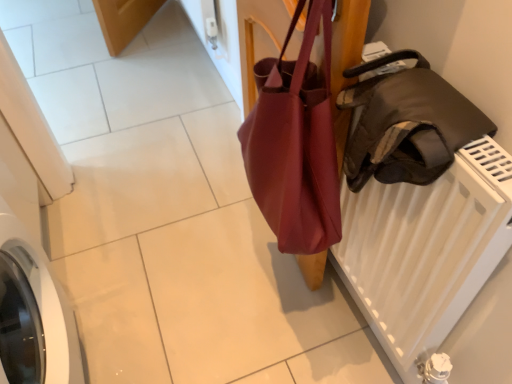
Question: Based on their sizes in the image, would you say matte brown bag at center is bigger or smaller than leather jacket at right?

Choices:
 (A) small
 (B) big

Answer: (B)

Question: Is matte brown bag at center wider or thinner than leather jacket at right?

Choices:
 (A) thin
 (B) wide

Answer: (A)

Question: Is point (288, 231) closer or farther from the camera than point (394, 135)?

Choices:
 (A) closer
 (B) farther

Answer: (B)

Question: Is leather jacket at right bigger or smaller than matte brown bag at center?

Choices:
 (A) big
 (B) small

Answer: (B)

Question: Is leather jacket at right wider or thinner than matte brown bag at center?

Choices:
 (A) wide
 (B) thin

Answer: (A)

Question: Is leather jacket at right to the left or to the right of matte brown bag at center in the image?

Choices:
 (A) left
 (B) right

Answer: (B)

Question: In terms of height, does leather jacket at right look taller or shorter compared to matte brown bag at center?

Choices:
 (A) tall
 (B) short

Answer: (B)